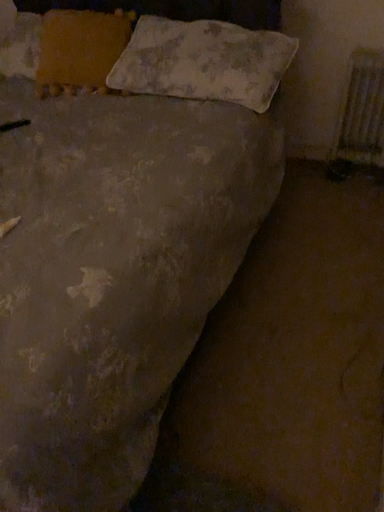
Question: Is metallic silver radiator at right shorter than orange fabric pillow at upper left, which ranks as the 2th pillow in right-to-left order?

Choices:
 (A) no
 (B) yes

Answer: (A)

Question: Can you see metallic silver radiator at right touching orange fabric pillow at upper left, acting as the first pillow starting from the left?

Choices:
 (A) yes
 (B) no

Answer: (B)

Question: Is metallic silver radiator at right far away from orange fabric pillow at upper left, acting as the first pillow starting from the left?

Choices:
 (A) no
 (B) yes

Answer: (B)

Question: Can you confirm if metallic silver radiator at right is thinner than orange fabric pillow at upper left, acting as the first pillow starting from the left?

Choices:
 (A) yes
 (B) no

Answer: (A)

Question: From the image's perspective, would you say metallic silver radiator at right is shown under orange fabric pillow at upper left, acting as the first pillow starting from the left?

Choices:
 (A) yes
 (B) no

Answer: (A)

Question: From the image's perspective, is metallic silver radiator at right above or below textured beige pillow at upper center, the first pillow positioned from the right?

Choices:
 (A) above
 (B) below

Answer: (B)

Question: Do you think metallic silver radiator at right is within textured beige pillow at upper center, the first pillow positioned from the right, or outside of it?

Choices:
 (A) inside
 (B) outside

Answer: (B)

Question: Considering the positions of metallic silver radiator at right and textured beige pillow at upper center, the 2th pillow positioned from the left, in the image, is metallic silver radiator at right taller or shorter than textured beige pillow at upper center, the 2th pillow positioned from the left,?

Choices:
 (A) short
 (B) tall

Answer: (B)

Question: Considering their positions, is metallic silver radiator at right located in front of or behind textured beige pillow at upper center, the 2th pillow positioned from the left?

Choices:
 (A) behind
 (B) front

Answer: (A)

Question: Looking at the image, does textured beige pillow at upper center, the first pillow positioned from the right, seem bigger or smaller compared to metallic silver radiator at right?

Choices:
 (A) big
 (B) small

Answer: (A)

Question: From a real-world perspective, is textured beige pillow at upper center, the first pillow positioned from the right, above or below metallic silver radiator at right?

Choices:
 (A) below
 (B) above

Answer: (B)

Question: Considering the positions of textured beige pillow at upper center, the first pillow positioned from the right, and metallic silver radiator at right in the image, is textured beige pillow at upper center, the first pillow positioned from the right, taller or shorter than metallic silver radiator at right?

Choices:
 (A) tall
 (B) short

Answer: (B)

Question: In the image, is textured beige pillow at upper center, the 2th pillow positioned from the left, positioned in front of or behind metallic silver radiator at right?

Choices:
 (A) behind
 (B) front

Answer: (B)

Question: Considering their positions, is metallic silver radiator at right located in front of or behind orange fabric pillow at upper left, acting as the first pillow starting from the left?

Choices:
 (A) front
 (B) behind

Answer: (B)

Question: Looking at the image, does metallic silver radiator at right seem bigger or smaller compared to orange fabric pillow at upper left, which ranks as the 2th pillow in right-to-left order?

Choices:
 (A) big
 (B) small

Answer: (B)